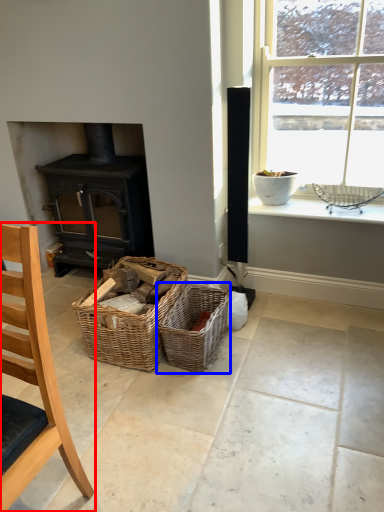
Question: Which point is further to the camera, chair (highlighted by a red box) or picnic basket (highlighted by a blue box)?

Choices:
 (A) chair
 (B) picnic basket

Answer: (B)